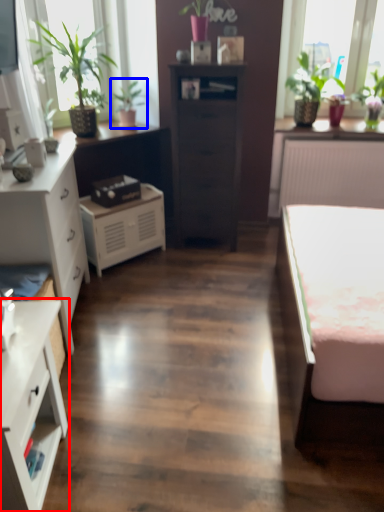
Question: Which point is further to the camera, chest of drawers (highlighted by a red box) or houseplant (highlighted by a blue box)?

Choices:
 (A) chest of drawers
 (B) houseplant

Answer: (B)